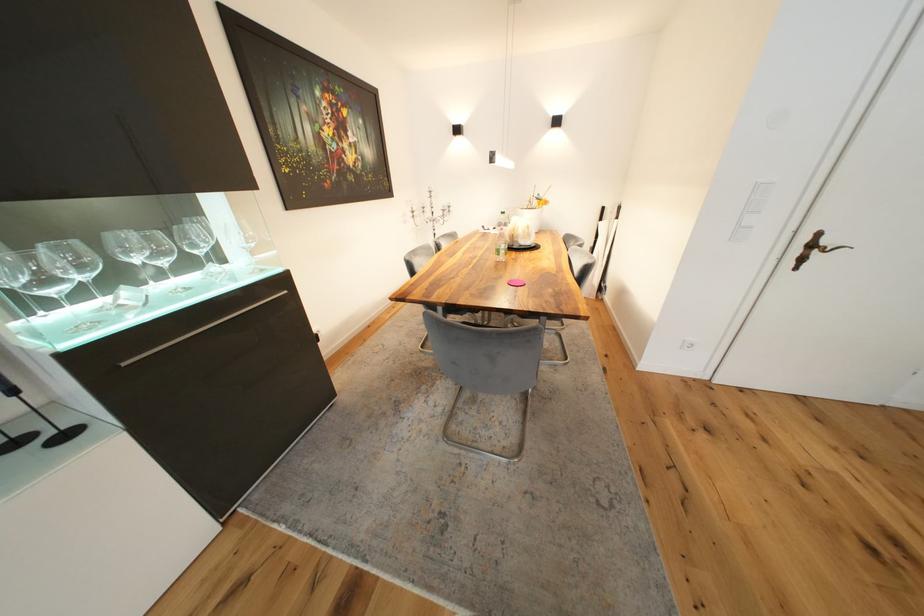
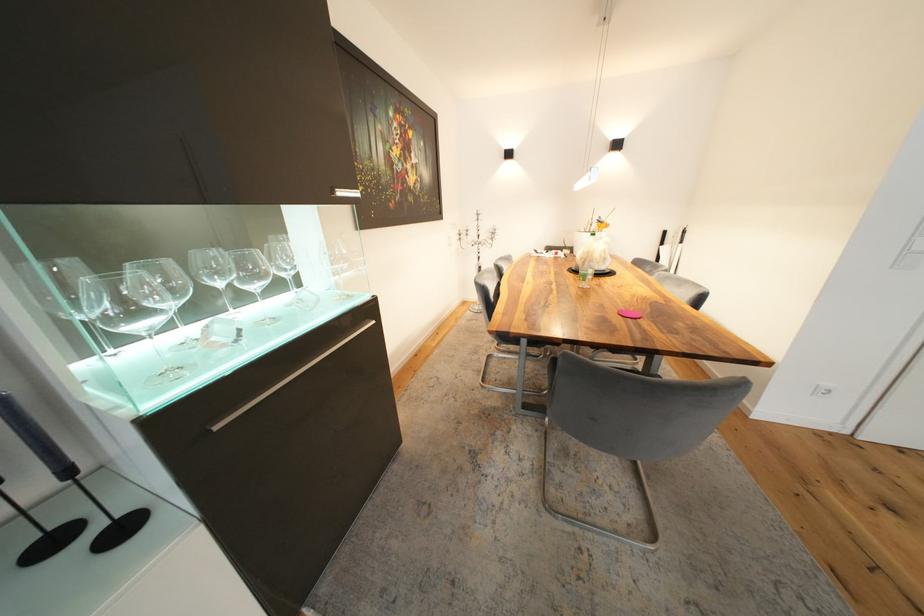
Where in the second image is the point corresponding to point (202, 254) from the first image?

(290, 276)